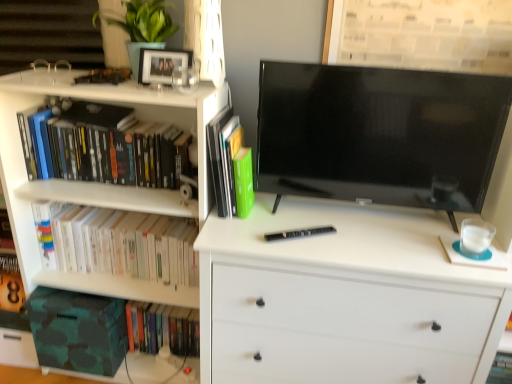
Locate an element on the screen. Image resolution: width=512 pixels, height=384 pixels. vacant space situated on the left part of black matte pen at center is located at coordinates (247, 233).